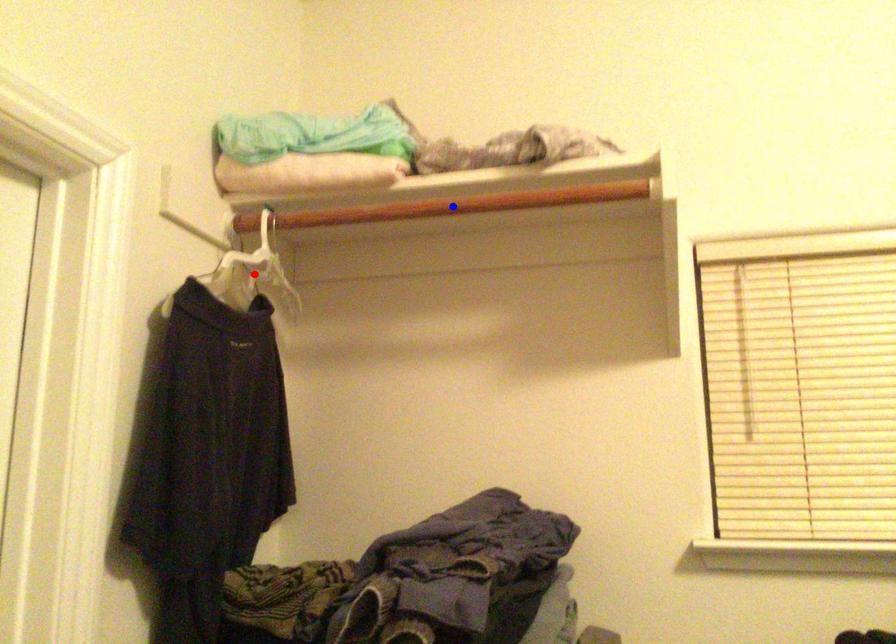
Question: Two points are marked on the image. Which point is closer to the camera?

Choices:
 (A) Blue point is closer.
 (B) Red point is closer.

Answer: (A)